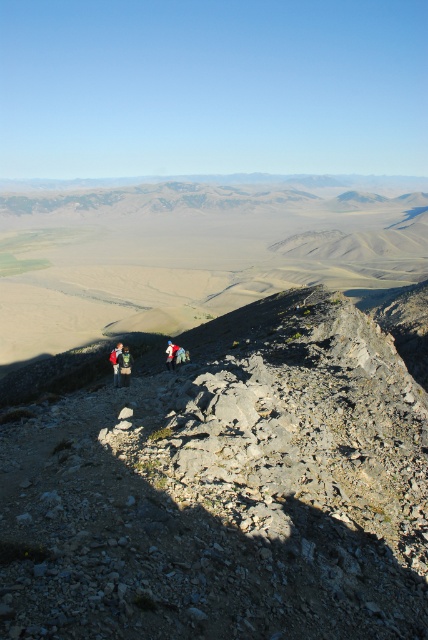
Question: Is camouflage fabric backpack at lower left to the left of red backpack at center from the viewer's perspective?

Choices:
 (A) no
 (B) yes

Answer: (A)

Question: Which of these objects is positioned farthest from the red backpack at center?

Choices:
 (A) camouflage fabric backpack at lower left
 (B) blue fabric jacket at center

Answer: (B)

Question: Can you confirm if camouflage fabric backpack at lower left is positioned above blue fabric jacket at center?

Choices:
 (A) yes
 (B) no

Answer: (B)

Question: Which of these objects is positioned closest to the red backpack at center?

Choices:
 (A) camouflage fabric backpack at lower left
 (B) blue fabric jacket at center

Answer: (A)

Question: Which of the following is the farthest from the observer?

Choices:
 (A) blue fabric jacket at center
 (B) camouflage fabric backpack at lower left

Answer: (A)

Question: Is red backpack at center closer to the viewer compared to blue fabric jacket at center?

Choices:
 (A) no
 (B) yes

Answer: (B)